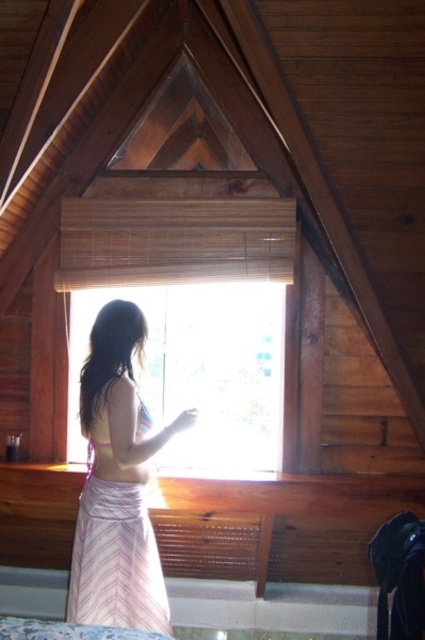
Question: Which object is farther from the camera taking this photo?

Choices:
 (A) transparent glass window at center
 (B) pink striped skirt at center

Answer: (A)

Question: Does transparent glass window at center have a lesser width compared to pink striped skirt at center?

Choices:
 (A) no
 (B) yes

Answer: (A)

Question: Is transparent glass window at center positioned at the back of pink striped skirt at center?

Choices:
 (A) no
 (B) yes

Answer: (B)

Question: Is transparent glass window at center further to the viewer compared to pink striped skirt at center?

Choices:
 (A) no
 (B) yes

Answer: (B)